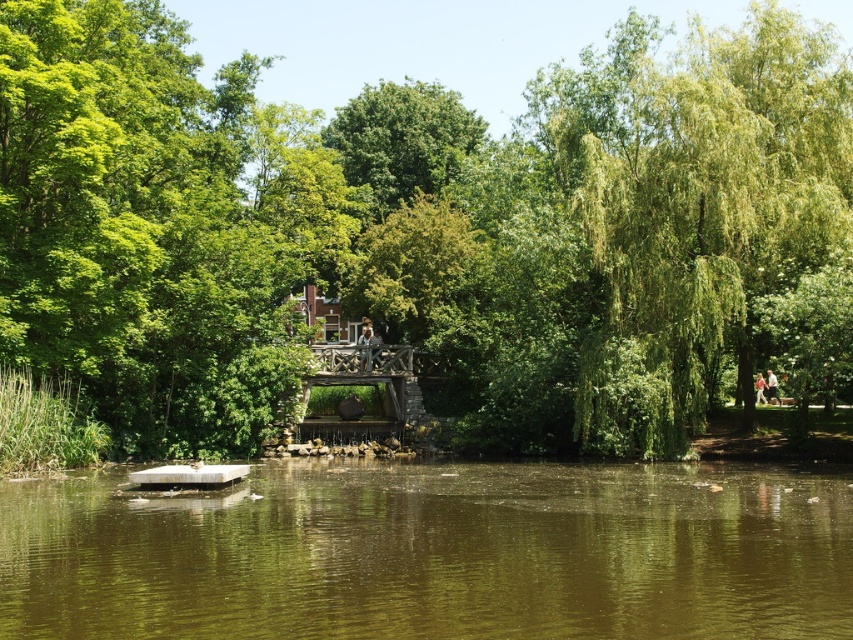
Question: Among these points, which one is farthest from the camera?

Choices:
 (A) (640, 616)
 (B) (149, 72)

Answer: (B)

Question: Can you confirm if green leafy tree at center is positioned above brown murky water at center?

Choices:
 (A) yes
 (B) no

Answer: (A)

Question: Can you confirm if green leafy tree at center is bigger than brown murky water at center?

Choices:
 (A) yes
 (B) no

Answer: (A)

Question: Which of the following is the closest to the observer?

Choices:
 (A) brown murky water at center
 (B) green leafy tree at center

Answer: (A)

Question: Where is green leafy tree at center located in relation to brown murky water at center in the image?

Choices:
 (A) below
 (B) above

Answer: (B)